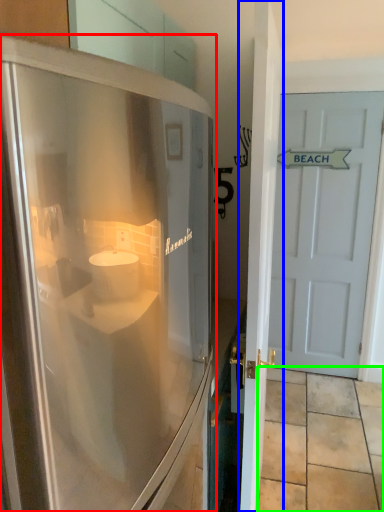
Question: Which object is the closest to the refrigerator (highlighted by a red box)? Choose among these: door (highlighted by a blue box) or tile (highlighted by a green box).

Choices:
 (A) door
 (B) tile

Answer: (A)